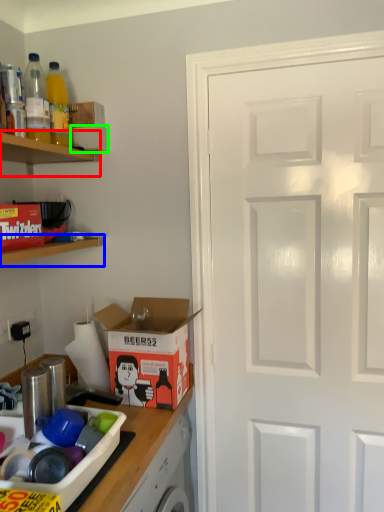
Question: Considering the real-world distances, which object is closest to shelf (highlighted by a red box)? shelf (highlighted by a blue box) or box (highlighted by a green box).

Choices:
 (A) shelf
 (B) box

Answer: (B)